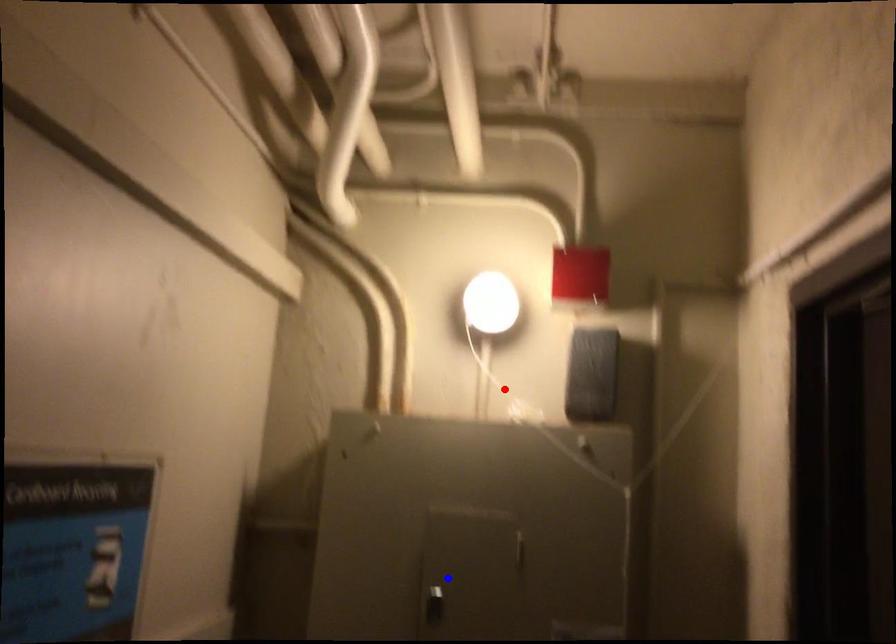
Question: In the image, two points are highlighted. Which point is nearer to the camera? Reply with the corresponding letter.

Choices:
 (A) blue point
 (B) red point

Answer: (A)